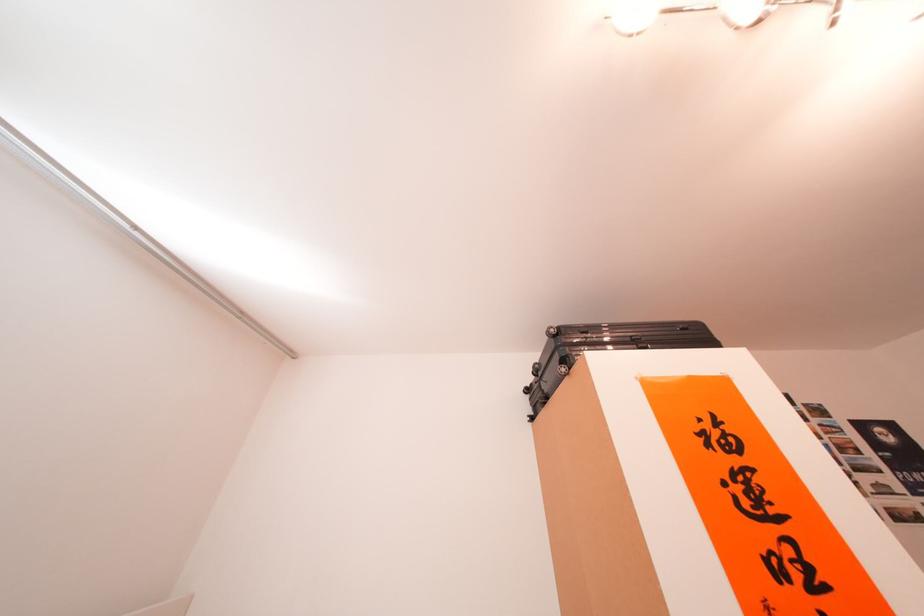
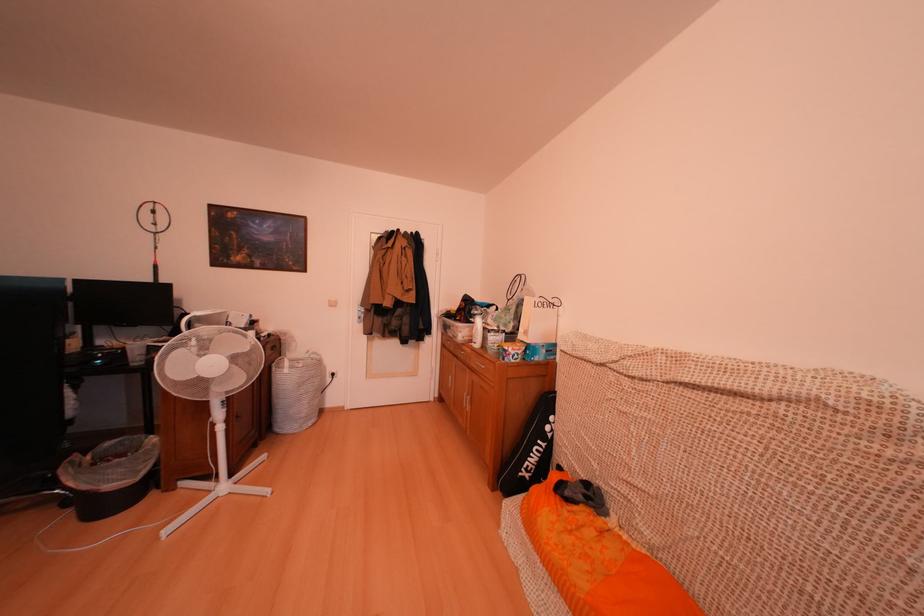
Question: The images are taken continuously from a first-person perspective. In which direction is your viewpoint rotating?

Choices:
 (A) Left
 (B) Right
 (C) Up
 (D) Down

Answer: (B)